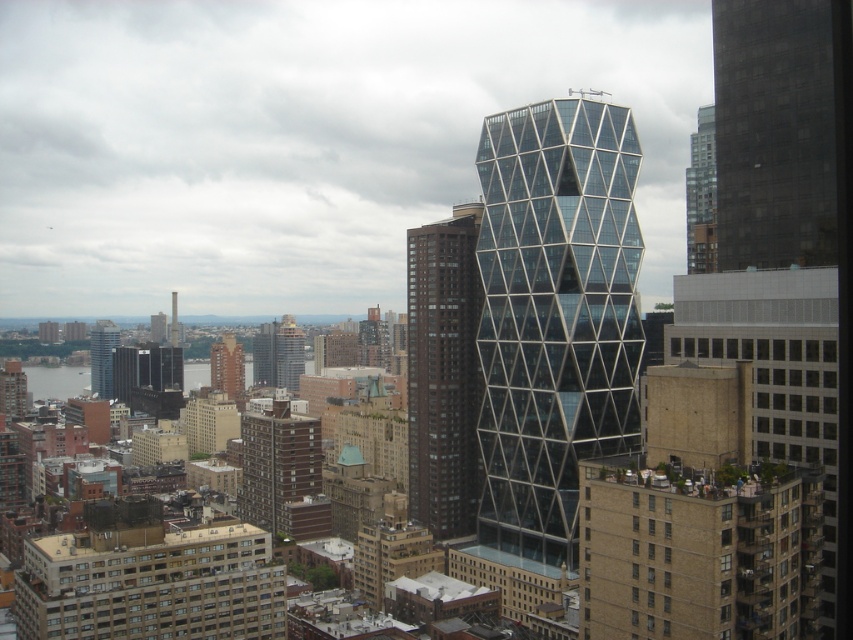
Does brown brick building at center have a lesser height compared to brick building at center?

No, brown brick building at center is not shorter than brick building at center.

Does brown brick building at center lie in front of brick building at center?

Yes, brown brick building at center is in front of brick building at center.

Who is more distant from viewer, [283,490] or [239,388]?

The point [239,388] is more distant.

Find the location of a particular element. Image resolution: width=853 pixels, height=640 pixels. brown brick building at center is located at coordinates (277, 461).

Does point (741, 163) come farther from viewer compared to point (473, 483)?

No, it is in front of (473, 483).

Does point (782, 154) lie behind point (456, 214)?

No, it is not.

You are a GUI agent. You are given a task and a screenshot of the screen. Output one action in this format:
    pyautogui.click(x=<x>, y=<y>)
    Task: Click on the dark gray concrete building at right
    
    Given the screenshot: What is the action you would take?
    pyautogui.click(x=778, y=129)

Is point (570, 113) farther from viewer compared to point (699, 193)?

No.

Can you confirm if glassy steel tower at center is smaller than brown brick building at upper right?

No.

This screenshot has height=640, width=853. What do you see at coordinates (550, 333) in the screenshot?
I see `glassy steel tower at center` at bounding box center [550, 333].

Identify the location of glassy steel tower at center. (550, 333).